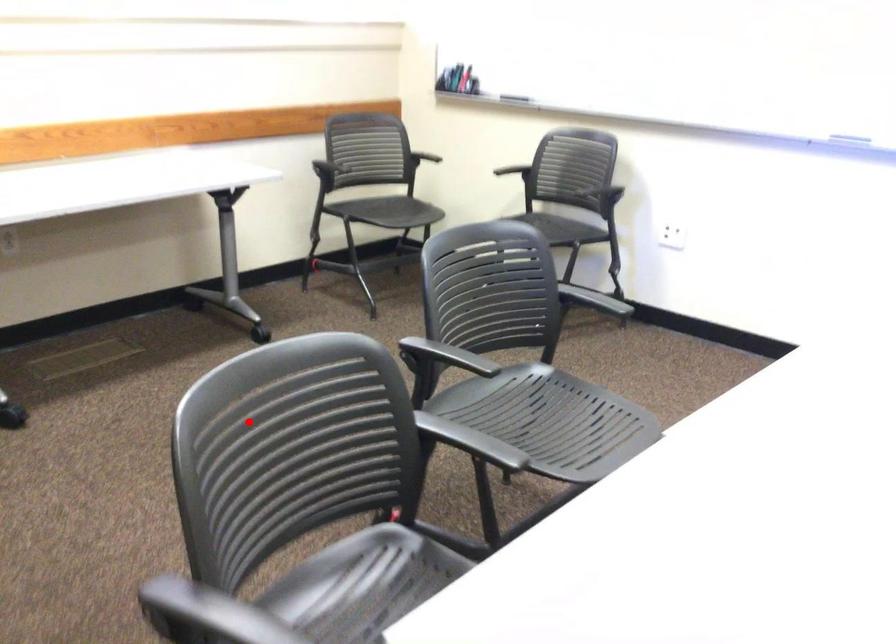
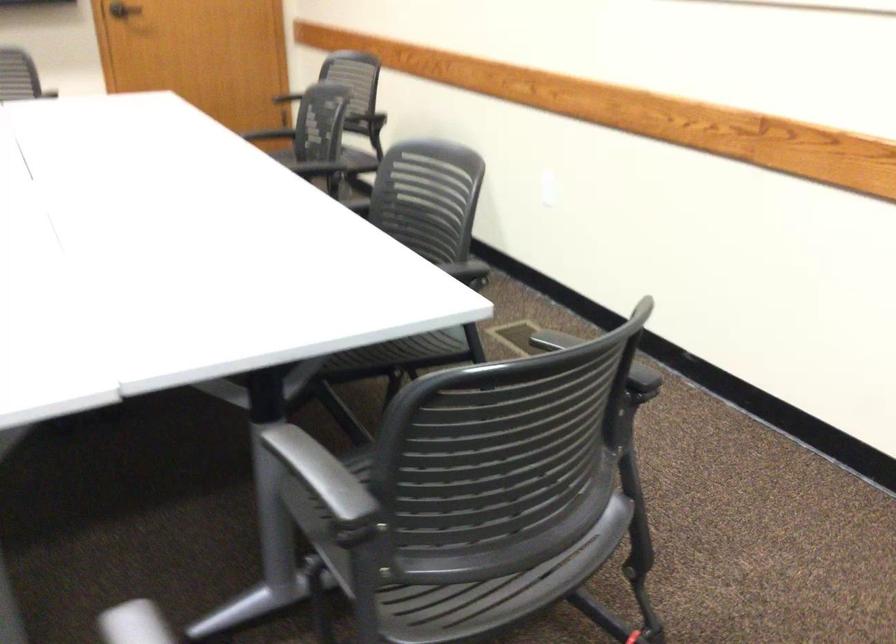
Question: I am providing you with two images of the same scene from different viewpoints. Image1 has a red point marked. In image2, the corresponding 3D location appears at what relative position? Reply with the corresponding letter.

Choices:
 (A) Closer
 (B) Farther

Answer: (A)